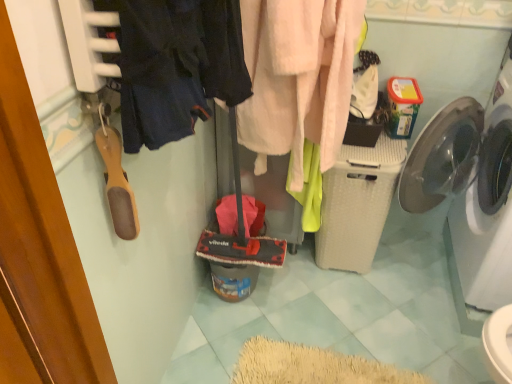
Question: Is dark blue fabric at upper left, positioned as the 2th clothing in right-to-left order, facing away from fuzzy pink towel at center, placed as the first clothing when sorted from right to left?

Choices:
 (A) yes
 (B) no

Answer: (B)

Question: Can you confirm if dark blue fabric at upper left, positioned as the 2th clothing in right-to-left order, is bigger than fuzzy pink towel at center, placed as the second clothing when sorted from left to right?

Choices:
 (A) no
 (B) yes

Answer: (A)

Question: Can fuzzy pink towel at center, placed as the first clothing when sorted from right to left, be found inside dark blue fabric at upper left, the 2th clothing positioned from the back?

Choices:
 (A) yes
 (B) no

Answer: (B)

Question: From a real-world perspective, is dark blue fabric at upper left, the first clothing viewed from the front, under fuzzy pink towel at center, positioned as the first clothing in back-to-front order?

Choices:
 (A) yes
 (B) no

Answer: (B)

Question: From a real-world perspective, is dark blue fabric at upper left, which is counted as the 1th clothing, starting from the left, on top of fuzzy pink towel at center, positioned as the first clothing in back-to-front order?

Choices:
 (A) yes
 (B) no

Answer: (A)

Question: From the image's perspective, relative to white plastic washing machine at right, positioned as the 2th washing machine in left-to-right order, is dark blue fabric at upper left, the first clothing viewed from the front, above or below?

Choices:
 (A) above
 (B) below

Answer: (A)

Question: Looking at their shapes, would you say dark blue fabric at upper left, the 2th clothing positioned from the back, is wider or thinner than white plastic washing machine at right, positioned as the 2th washing machine in left-to-right order?

Choices:
 (A) wide
 (B) thin

Answer: (B)

Question: From a real-world perspective, relative to white plastic washing machine at right, the first washing machine when ordered from right to left, is dark blue fabric at upper left, the 2th clothing positioned from the back, vertically above or below?

Choices:
 (A) below
 (B) above

Answer: (B)

Question: Would you say dark blue fabric at upper left, positioned as the 2th clothing in right-to-left order, is inside or outside white plastic washing machine at right, positioned as the 2th washing machine in left-to-right order?

Choices:
 (A) inside
 (B) outside

Answer: (B)

Question: In terms of height, does dark blue fabric at upper left, the 2th clothing positioned from the back, look taller or shorter compared to white textured laundry basket at center-right, the first washing machine in the left-to-right sequence?

Choices:
 (A) short
 (B) tall

Answer: (A)

Question: In terms of size, does dark blue fabric at upper left, which is counted as the 1th clothing, starting from the left, appear bigger or smaller than white textured laundry basket at center-right, which ranks as the second washing machine in right-to-left order?

Choices:
 (A) small
 (B) big

Answer: (A)

Question: Considering their positions, is dark blue fabric at upper left, the 2th clothing positioned from the back, located in front of or behind white textured laundry basket at center-right, which ranks as the second washing machine in right-to-left order?

Choices:
 (A) front
 (B) behind

Answer: (A)

Question: Looking at their shapes, would you say dark blue fabric at upper left, the first clothing viewed from the front, is wider or thinner than white textured laundry basket at center-right, which ranks as the second washing machine in right-to-left order?

Choices:
 (A) thin
 (B) wide

Answer: (A)

Question: From the image's perspective, is fuzzy pink towel at center, placed as the first clothing when sorted from right to left, located above or below wooden shoe at left?

Choices:
 (A) below
 (B) above

Answer: (B)

Question: Considering their positions, is fuzzy pink towel at center, the 2th clothing when ordered from front to back, located in front of or behind wooden shoe at left?

Choices:
 (A) behind
 (B) front

Answer: (A)